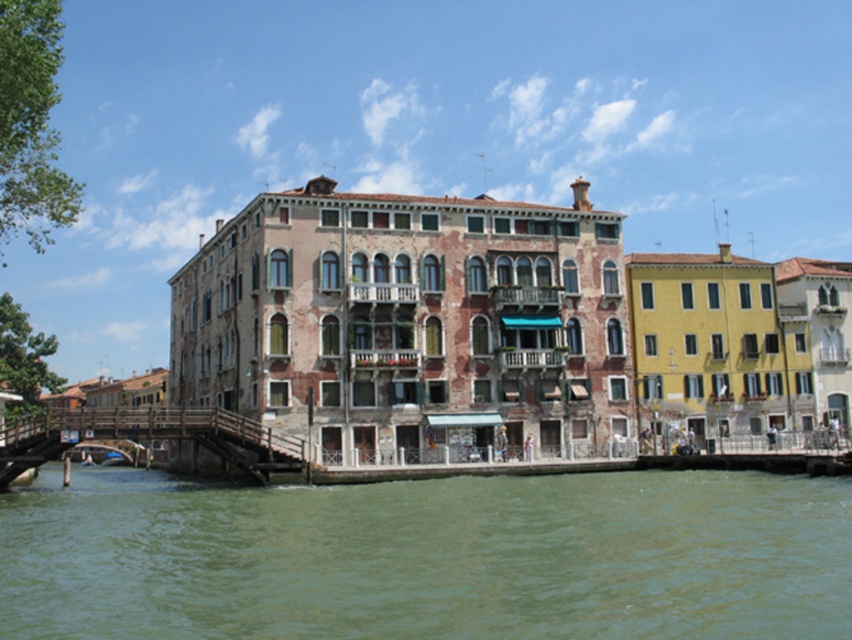
Question: Can you confirm if green water at lower center is wider than wooden bridge at lower left?

Choices:
 (A) no
 (B) yes

Answer: (B)

Question: Is green water at lower center smaller than wooden bridge at lower left?

Choices:
 (A) no
 (B) yes

Answer: (B)

Question: Which of the following is the closest to the observer?

Choices:
 (A) wooden bridge at lower left
 (B) green water at lower center

Answer: (B)

Question: Is green water at lower center behind wooden bridge at lower left?

Choices:
 (A) no
 (B) yes

Answer: (A)

Question: Which point is farther from the camera taking this photo?

Choices:
 (A) (203, 410)
 (B) (274, 547)

Answer: (A)